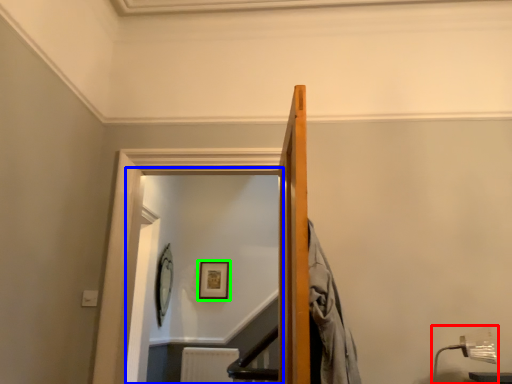
Question: Which object is the closest to the lamp (highlighted by a red box)? Choose among these: glass door (highlighted by a blue box) or picture frame (highlighted by a green box).

Choices:
 (A) glass door
 (B) picture frame

Answer: (A)